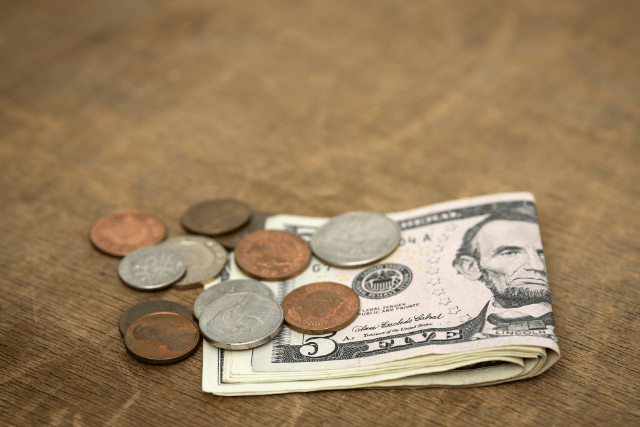
In order to click on bust in this screenshot , I will do `click(508, 248)`, `click(317, 301)`, `click(232, 312)`, `click(145, 327)`, `click(278, 251)`.